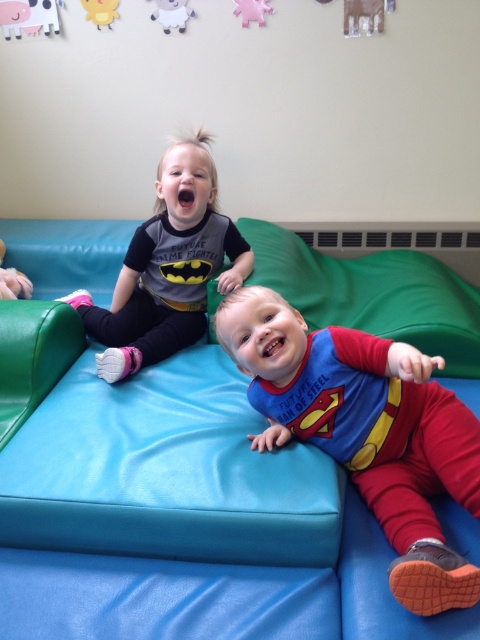
Question: Which object is positioned closest to the yellow plush sheep at upper left?

Choices:
 (A) pink fabric toy at upper center
 (B) superman costume at center
 (C) matte black shirt at upper left
 (D) white plush sheep at upper center

Answer: (D)

Question: Which point is farther from the camera taking this photo?

Choices:
 (A) (257, 0)
 (B) (200, 188)
 (C) (169, 8)
 (D) (471, 445)

Answer: (C)

Question: Does superman costume at center come in front of white plush sheep at upper center?

Choices:
 (A) yes
 (B) no

Answer: (A)

Question: Is superman costume at center above white plush sheep at upper center?

Choices:
 (A) yes
 (B) no

Answer: (B)

Question: Estimate the real-world distances between objects in this image. Which object is closer to the matte black shirt at upper left?

Choices:
 (A) yellow plush sheep at upper left
 (B) superman costume at center

Answer: (B)

Question: Does superman costume at center appear under yellow plush sheep at upper left?

Choices:
 (A) yes
 (B) no

Answer: (A)